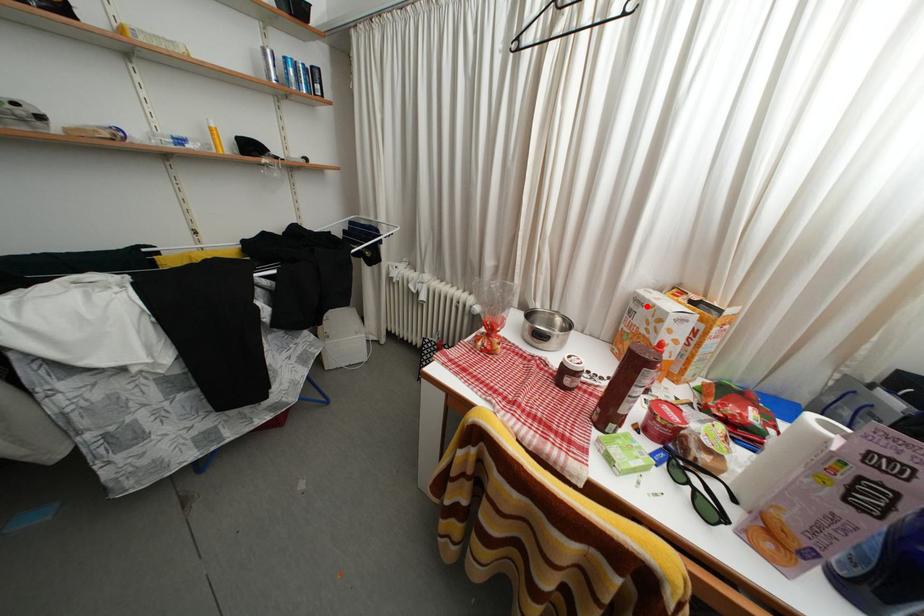
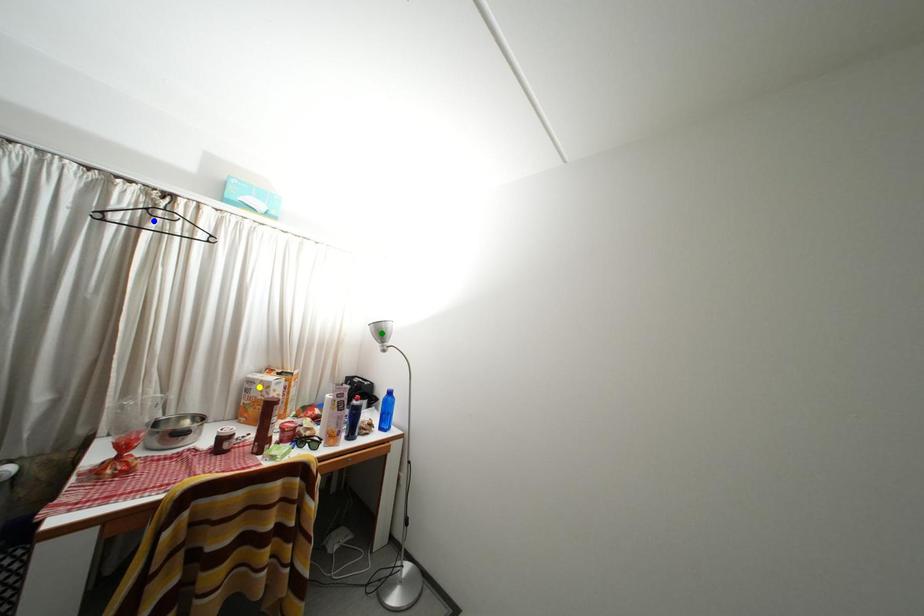
Question: I am providing you with two images of the same scene from different viewpoints. A red point is marked on the first image. You are given multiple points on the second image. Can you choose the point in image 2 that corresponds to the point in image 1?

Choices:
 (A) yellow point
 (B) green point
 (C) blue point

Answer: (A)